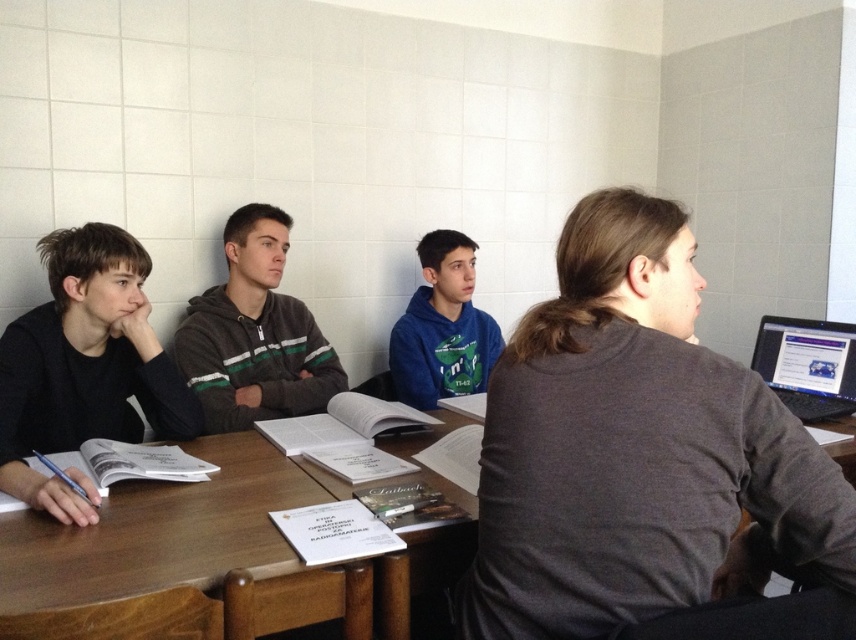
You are a photographer trying to capture a group photo of the wooden table at center and the black matte shirt at left. Which object should you focus on first if you want to ensure both are in focus?

The wooden table at center is shorter than the black matte shirt at left, so you should focus on the black matte shirt at left first to ensure both are in focus.

You are standing in the classroom and want to move from point A to point B. Point A is at coordinate point (403, 449) and point B is at coordinate point (15, 609). Which point is closer to you?

Point A at coordinate point (403, 449) is closer to you since it is further to the camera than point B at coordinate point (15, 609).